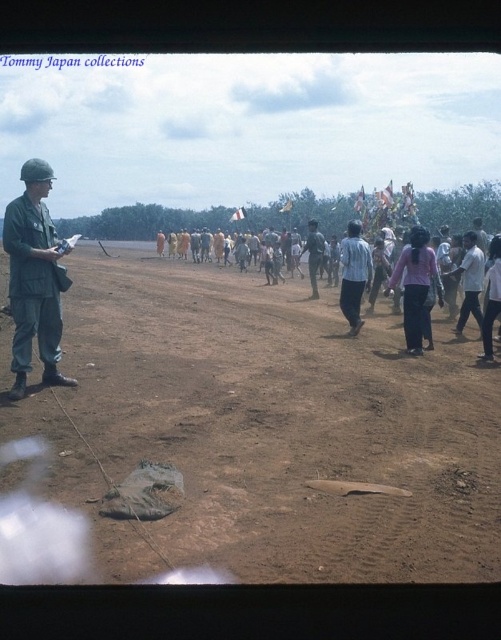
What do you see at coordinates (268, 428) in the screenshot? The height and width of the screenshot is (640, 501). I see `brown sandy dirt at center` at bounding box center [268, 428].

Is point (71, 403) in front of point (319, 257)?

Yes, point (71, 403) is in front of point (319, 257).

The image size is (501, 640). I want to click on brown sandy dirt at center, so click(x=268, y=428).

Is light brown fabric people at center wider than pink fabric pants at center-right?

Yes, light brown fabric people at center is wider than pink fabric pants at center-right.

Who is higher up, light brown fabric people at center or pink fabric pants at center-right?

light brown fabric people at center

Between point (438, 280) and point (408, 342), which one is positioned behind?

Point (408, 342)

The width and height of the screenshot is (501, 640). I want to click on light brown fabric people at center, so click(x=443, y=288).

Does light brown fabric people at center appear over matte green uniform at left?

Correct, light brown fabric people at center is located above matte green uniform at left.

At what (x,y) coordinates should I click in order to perform the action: click on light brown fabric people at center. Please return your answer as a coordinate pair (x, y). The width and height of the screenshot is (501, 640). Looking at the image, I should click on (443, 288).

I want to click on light brown fabric people at center, so click(443, 288).